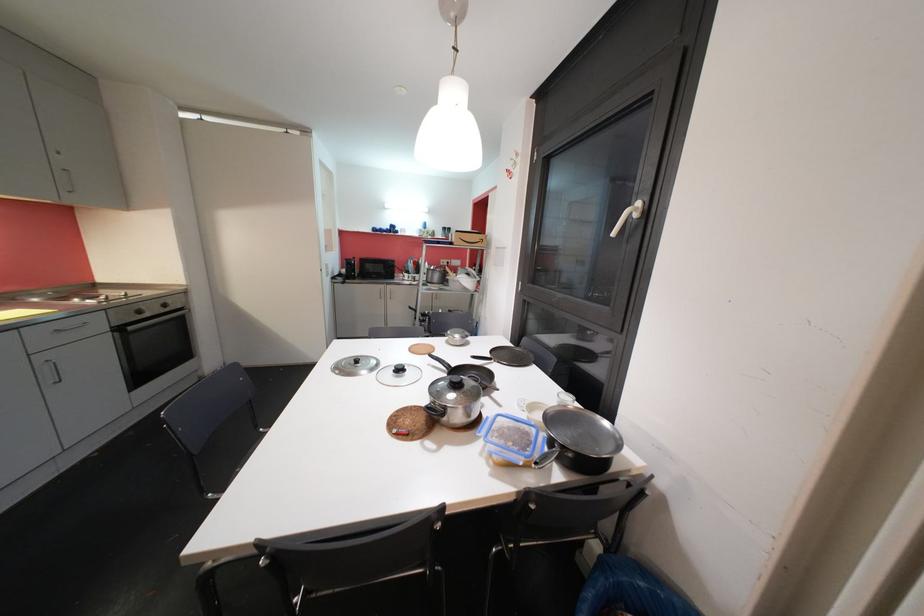
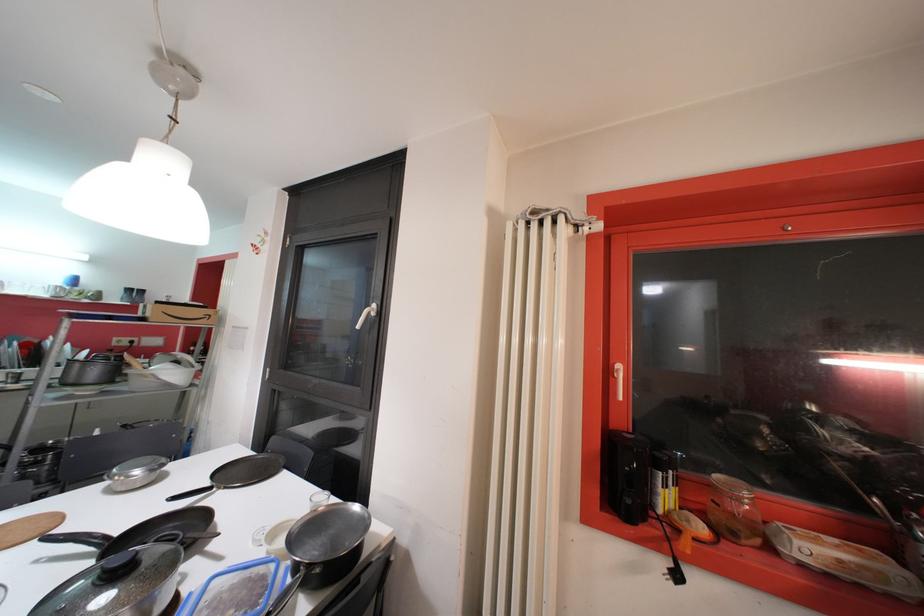
In the second image, find the point that corresponds to (506,436) in the first image.

(222, 608)